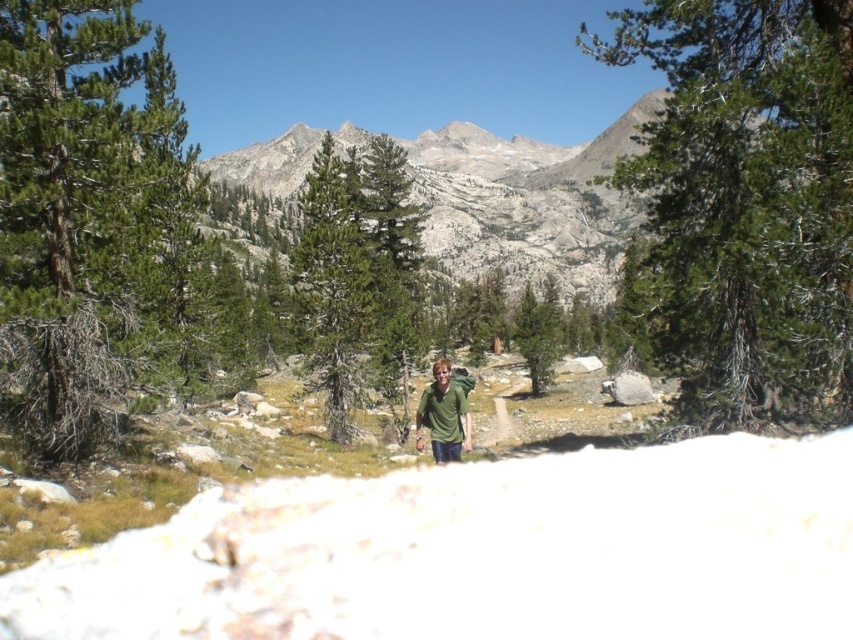
Question: Which object is positioned closest to the green matte tree at center?

Choices:
 (A) green rough bark tree at center
 (B) green needle-like at center
 (C) green matte shirt at center
 (D) rocky gray mountain at upper center

Answer: (B)

Question: From the image, what is the correct spatial relationship of green needle-like at center in relation to rocky gray mountain at upper center?

Choices:
 (A) above
 (B) below

Answer: (B)

Question: Is rocky gray mountain at upper center in front of green matte shirt at center?

Choices:
 (A) yes
 (B) no

Answer: (B)

Question: Which object is the farthest from the green matte shirt at center?

Choices:
 (A) green rough bark tree at left
 (B) rocky gray mountain at upper center

Answer: (B)

Question: Which point is farther to the camera?

Choices:
 (A) green matte tree at center
 (B) green rough bark tree at left

Answer: (A)

Question: Is green matte shirt at center bigger than green matte tree at center?

Choices:
 (A) yes
 (B) no

Answer: (B)